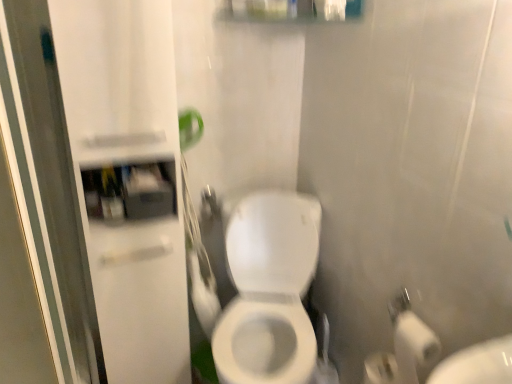
Question: From the image's perspective, is transparent glass screen door at left, which is counted as the second screen door, starting from the right, located beneath white glossy toilet at center?

Choices:
 (A) no
 (B) yes

Answer: (A)

Question: Is transparent glass screen door at left, arranged as the 1th screen door when viewed from the left, completely or partially outside of white glossy toilet at center?

Choices:
 (A) yes
 (B) no

Answer: (A)

Question: From a real-world perspective, is transparent glass screen door at left, arranged as the 1th screen door when viewed from the left, physically above white glossy toilet at center?

Choices:
 (A) yes
 (B) no

Answer: (A)

Question: Does transparent glass screen door at left, arranged as the 1th screen door when viewed from the left, have a lesser height compared to white glossy toilet at center?

Choices:
 (A) yes
 (B) no

Answer: (B)

Question: Could white glossy toilet at center be considered to be inside transparent glass screen door at left, arranged as the 1th screen door when viewed from the left?

Choices:
 (A) yes
 (B) no

Answer: (B)

Question: From their relative heights in the image, would you say matte plastic medicine cabinet at upper left is taller or shorter than white glossy cabinet at left, arranged as the first screen door when viewed from the right?

Choices:
 (A) tall
 (B) short

Answer: (B)

Question: Is matte plastic medicine cabinet at upper left bigger or smaller than white glossy cabinet at left, the 2th screen door positioned from the left?

Choices:
 (A) big
 (B) small

Answer: (B)

Question: From a real-world perspective, is matte plastic medicine cabinet at upper left positioned above or below white glossy cabinet at left, arranged as the first screen door when viewed from the right?

Choices:
 (A) below
 (B) above

Answer: (B)

Question: Does point (162, 210) appear closer or farther from the camera than point (118, 299)?

Choices:
 (A) farther
 (B) closer

Answer: (B)

Question: From a real-world perspective, is matte plastic medicine cabinet at upper left above or below white glossy toilet at center?

Choices:
 (A) below
 (B) above

Answer: (B)

Question: Based on their sizes in the image, would you say matte plastic medicine cabinet at upper left is bigger or smaller than white glossy toilet at center?

Choices:
 (A) small
 (B) big

Answer: (A)

Question: From their relative heights in the image, would you say matte plastic medicine cabinet at upper left is taller or shorter than white glossy toilet at center?

Choices:
 (A) tall
 (B) short

Answer: (B)

Question: Is matte plastic medicine cabinet at upper left in front of or behind white glossy toilet at center in the image?

Choices:
 (A) front
 (B) behind

Answer: (B)

Question: Is white glossy toilet at center in front of or behind white glossy cabinet at left, arranged as the first screen door when viewed from the right, in the image?

Choices:
 (A) front
 (B) behind

Answer: (B)

Question: Is white glossy toilet at center wider or thinner than white glossy cabinet at left, arranged as the first screen door when viewed from the right?

Choices:
 (A) wide
 (B) thin

Answer: (A)